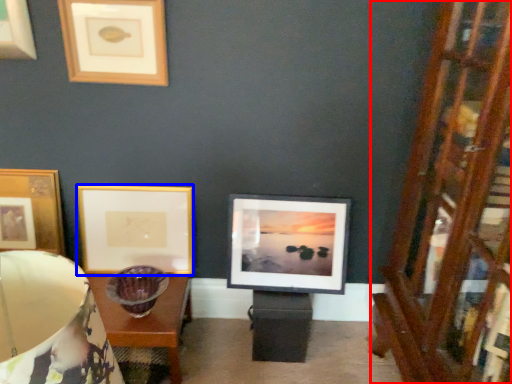
Question: Among these objects, which one is farthest to the camera, dresser (highlighted by a red box) or picture frame (highlighted by a blue box)?

Choices:
 (A) dresser
 (B) picture frame

Answer: (B)